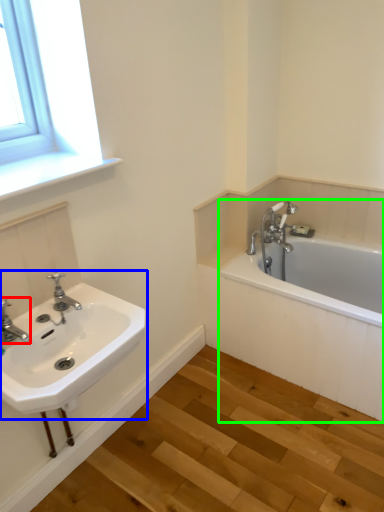
Question: Estimate the real-world distances between objects in this image. Which object is farther from tap (highlighted by a red box), sink (highlighted by a blue box) or bathtub (highlighted by a green box)?

Choices:
 (A) sink
 (B) bathtub

Answer: (B)